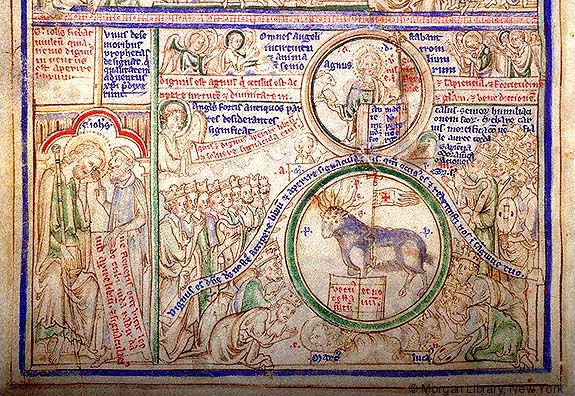
At what (x,y) coordinates should I click in order to perform the action: click on green robe. Please return your answer as a coordinate pair (x, y). Looking at the image, I should click on (500, 337), (260, 293), (210, 264), (67, 207), (49, 331), (513, 75), (486, 58).